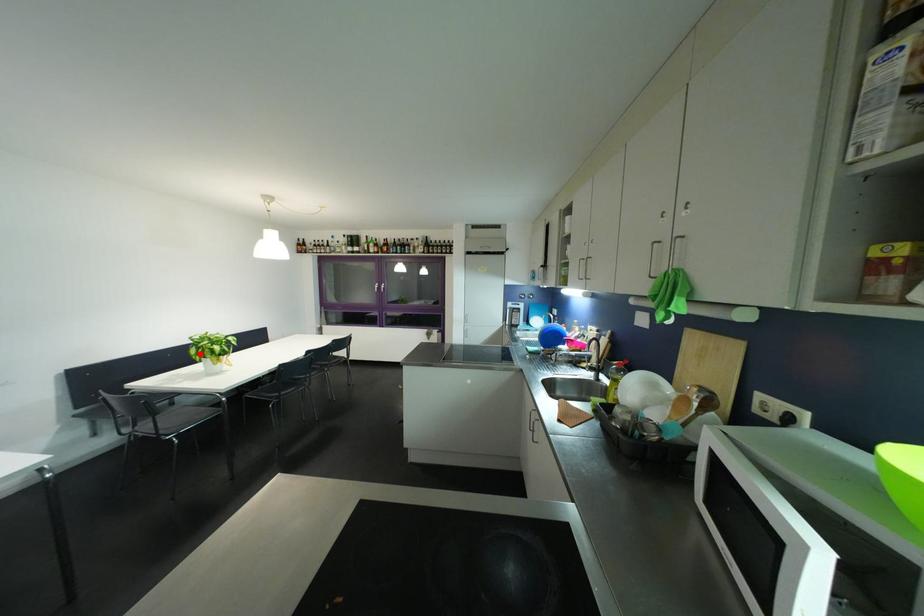
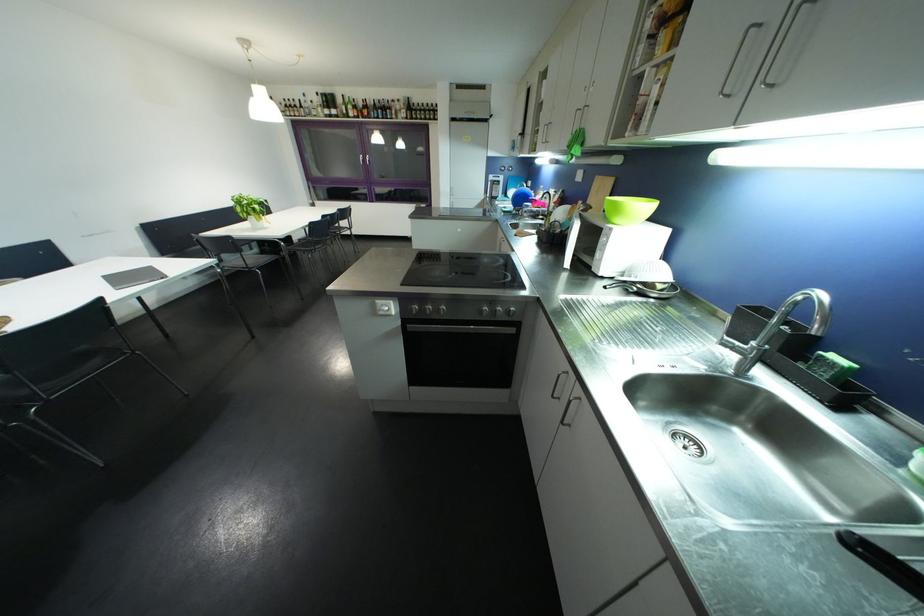
Locate, in the second image, the point that corresponds to the highlighted location in the first image.

(246, 212)